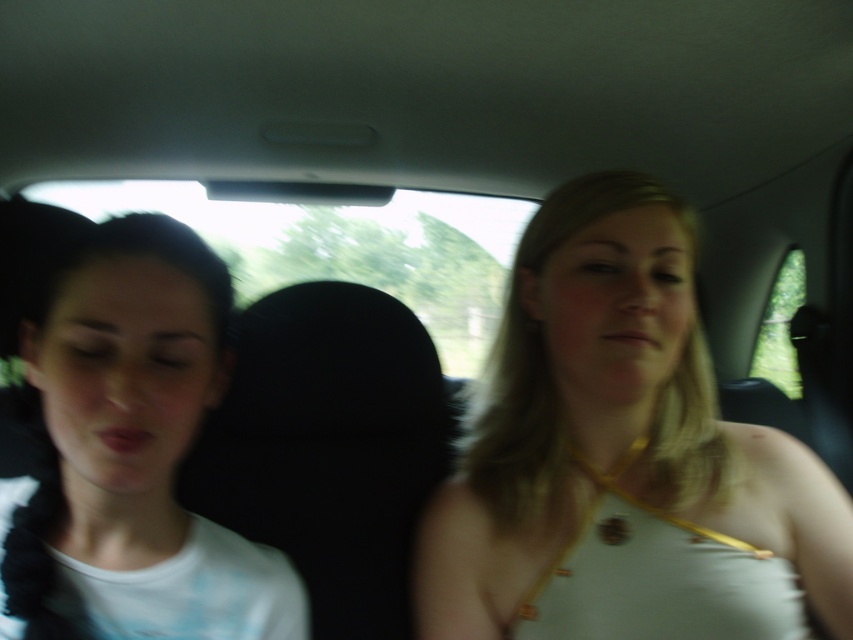
Between white fabric top at center and white matte shirt at left, which one appears on the right side from the viewer's perspective?

white fabric top at center is more to the right.

Between white fabric top at center and white matte shirt at left, which one has more height?

With more height is white fabric top at center.

Is point (526, 458) in front of point (45, 324)?

No, (526, 458) is further to viewer.

What are the coordinates of `white fabric top at center` in the screenshot? It's located at (612, 436).

Is white matte shirt at left further to camera compared to black fabric headrest at center?

No, it is not.

Between point (148, 417) and point (340, 404), which one is positioned in front?

Point (148, 417)

I want to click on white matte shirt at left, so click(x=132, y=452).

Between white fabric top at center and black fabric headrest at center, which one appears on the right side from the viewer's perspective?

From the viewer's perspective, white fabric top at center appears more on the right side.

Between white fabric top at center and black fabric headrest at center, which one has less height?

Standing shorter between the two is black fabric headrest at center.

What do you see at coordinates (612, 436) in the screenshot?
I see `white fabric top at center` at bounding box center [612, 436].

You are a GUI agent. You are given a task and a screenshot of the screen. Output one action in this format:
    pyautogui.click(x=<x>, y=<y>)
    Task: Click on the white fabric top at center
    This screenshot has width=853, height=640.
    Given the screenshot: What is the action you would take?
    click(612, 436)